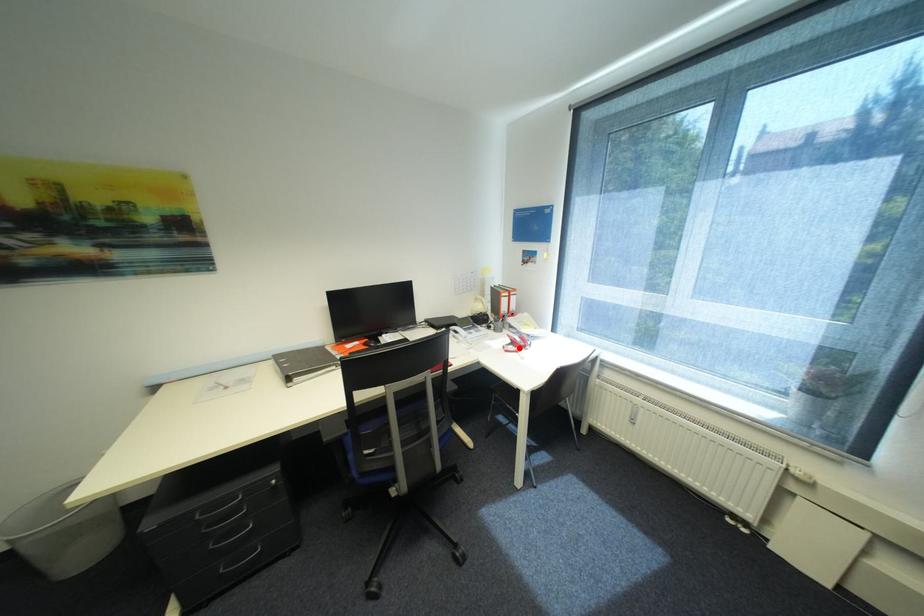
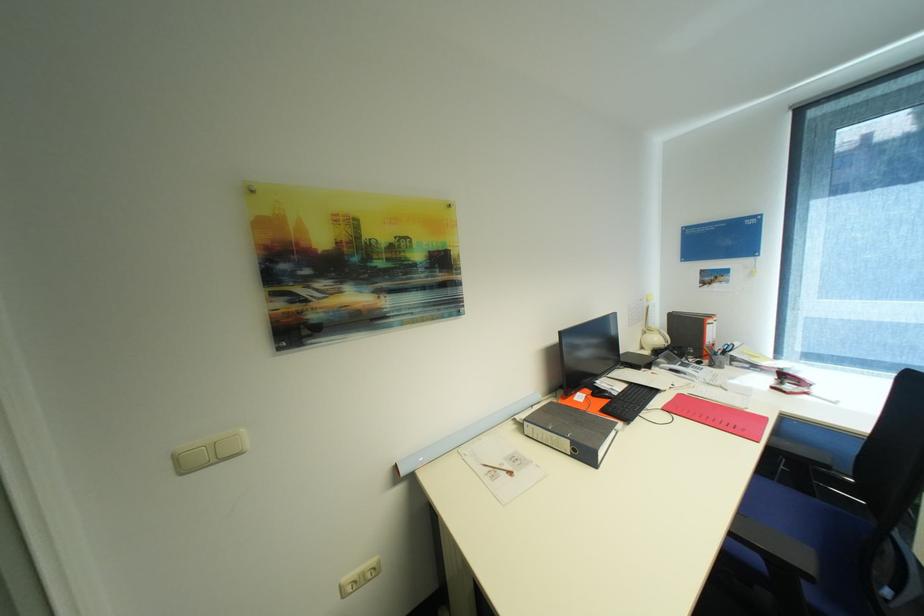
The point at the highlighted location is marked in the first image. Where is the corresponding point in the second image?

(796, 387)